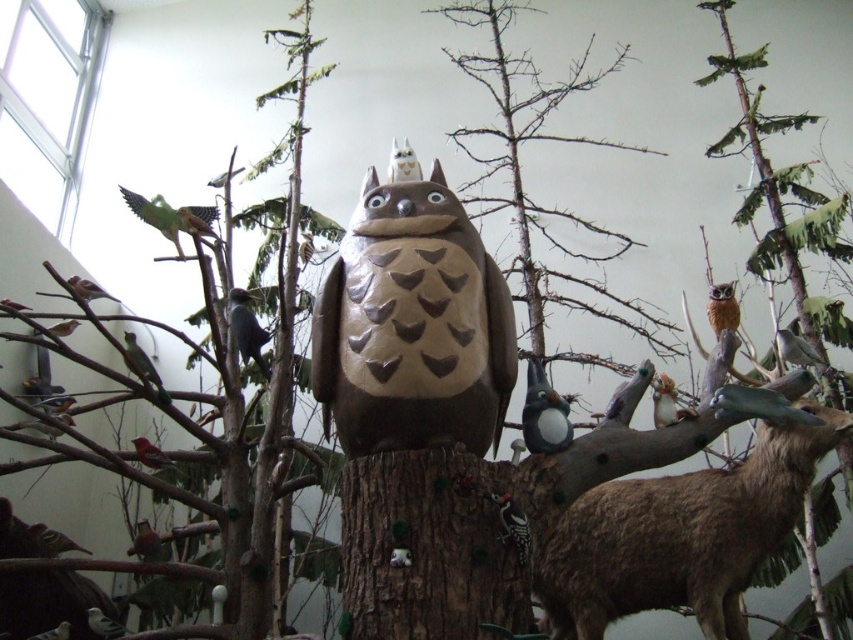
From the picture: You are an art curator planning to install a protective glass panel between the viewer and the display. The glass panel must be positioned so that both the white matte bird at center and the brown speckled owl at upper right are visible. Given their positions, which object will require the glass panel to be placed closer to the viewer to ensure it isn not obscured?

The white matte bird at center is closer to the viewer than the brown speckled owl at upper right. Therefore, the glass panel should be placed closer to the viewer to ensure the white matte bird at center is not blocked, as it is nearer and would require the glass to be positioned at its closer distance to avoid obstruction.

Please look at the image and locate the point marked at coordinates (544, 413). What object is positioned exactly at that point?

The point at coordinates (544, 413) marks the location of the white matte bird at center.

You are a small toy mouse that is 1 foot long. You want to move from the matte gray bird at left to the brown rough bark at center. Can you fit through the space between them?

The distance between the brown rough bark at center and the matte gray bird at left is 3.57 feet. Since the toy mouse is only 1 foot long, it can easily move through the space between them as there is enough room.